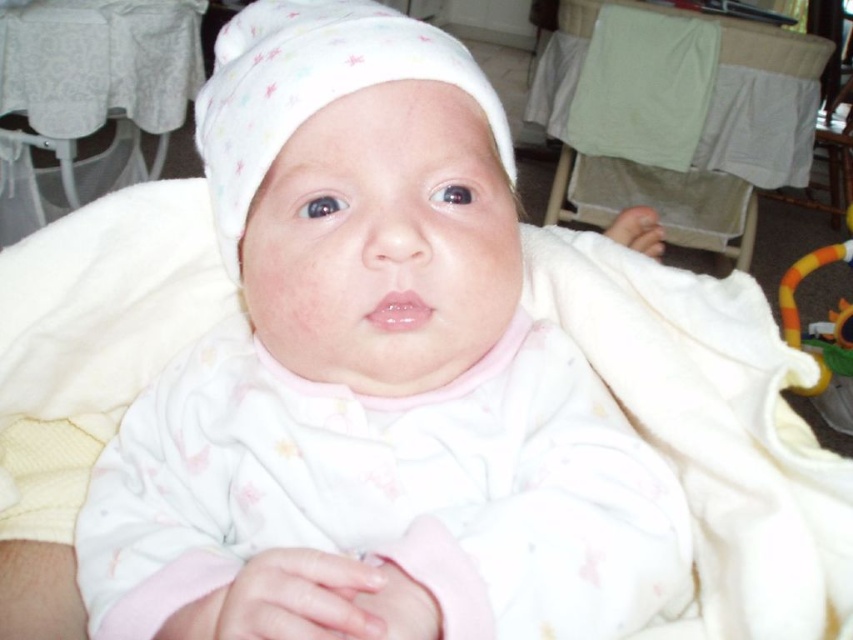
You are a photographer adjusting your camera to focus on two specific points in the image of the baby. The first point is at coordinates point (160, 467) and the second point is at coordinates point (236, 70). Which point should you focus on first to ensure proper depth of field?

You should focus on point (160, 467) first because it is closer to the viewer than point (236, 70), ensuring proper depth of field.

You are a photographer setting up for a baby photoshoot. You have a white soft baby at center and a white soft hat at center in your frame. Since the baby needs to be the main focus, which object should you ensure is positioned more centrally to emphasize its prominence?

The white soft baby at center should be positioned more centrally because its width is larger than the white soft hat at center, making it naturally draw more attention.

You are a pediatrician examining a newborn. The baby is positioned in front of you, and you need to place a small medical tool between the white soft baby at center and the white soft hat at center. The tool requires a minimum of 3 inches of space to function properly. Can you determine if there is enough space between them?

The white soft baby at center is 3.32 inches away from the white soft hat at center, which is more than the required 3 inches. Therefore, there is sufficient space to place the medical tool between them.